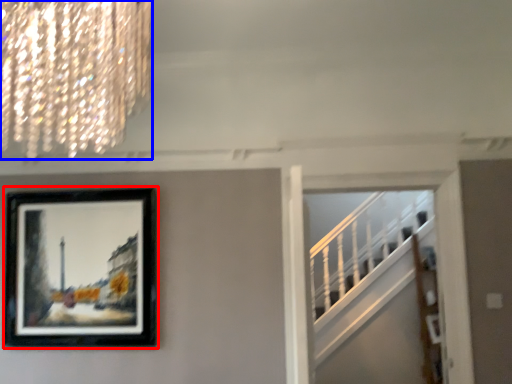
Question: Which object appears farthest to the camera in this image, picture frame (highlighted by a red box) or lamp (highlighted by a blue box)?

Choices:
 (A) picture frame
 (B) lamp

Answer: (A)